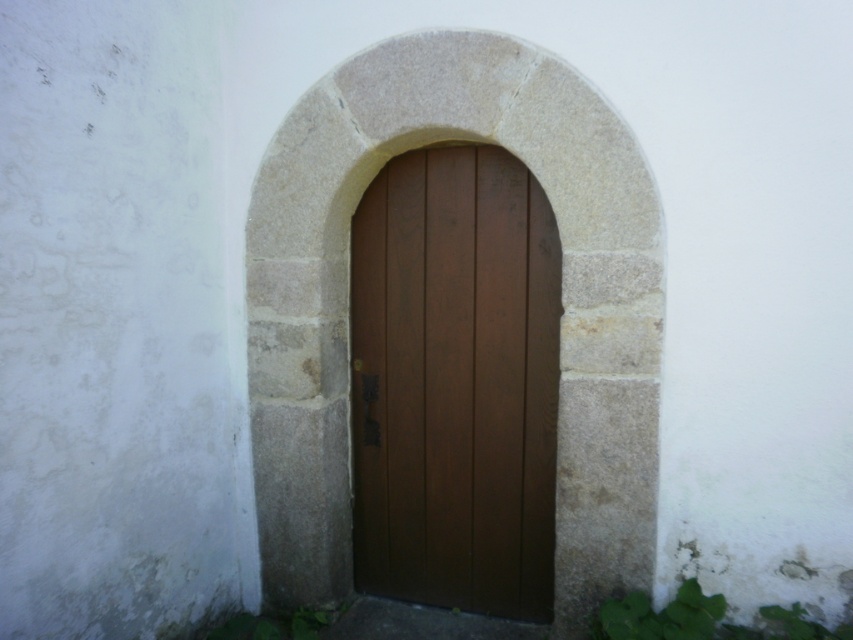
Question: Can you confirm if smooth stone archway at center is positioned to the left of brown wooden door at center?

Choices:
 (A) yes
 (B) no

Answer: (A)

Question: Does smooth stone archway at center appear over brown wooden door at center?

Choices:
 (A) no
 (B) yes

Answer: (B)

Question: Which point appears closest to the camera in this image?

Choices:
 (A) (248, 250)
 (B) (448, 225)

Answer: (A)

Question: Can you confirm if smooth stone archway at center is positioned to the left of brown wooden door at center?

Choices:
 (A) yes
 (B) no

Answer: (A)

Question: Which point is closer to the camera taking this photo?

Choices:
 (A) (550, 232)
 (B) (633, 508)

Answer: (B)

Question: Which of the following is the farthest from the observer?

Choices:
 (A) tap(405, 388)
 (B) tap(456, 90)

Answer: (A)